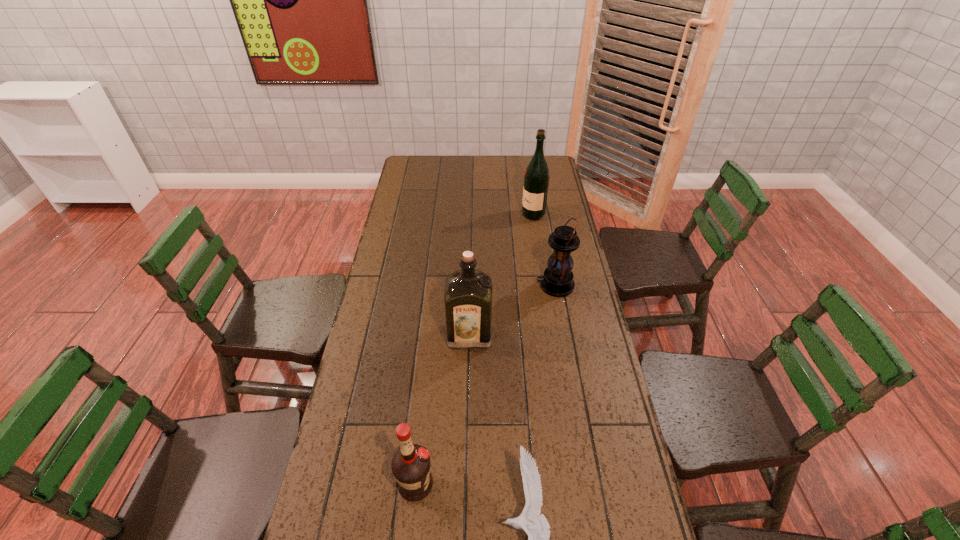
At what (x,y) coordinates should I click in order to perform the action: click on the farthest object. Please return your answer as a coordinate pair (x, y). Looking at the image, I should click on (536, 178).

Find the location of a particular element. This screenshot has height=540, width=960. the rightmost liquor is located at coordinates (536, 178).

The height and width of the screenshot is (540, 960). I want to click on the third nearest object, so click(468, 292).

Identify the location of the second nearest liquor. (468, 292).

Locate an element on the screen. the fourth nearest object is located at coordinates (557, 280).

Locate an element on the screen. the leftmost object is located at coordinates (410, 465).

The width and height of the screenshot is (960, 540). Identify the location of the shortest liquor. (410, 465).

Find the location of a particular element. The height and width of the screenshot is (540, 960). free space located 0.310m on the front-facing side of the farthest object is located at coordinates (451, 214).

The height and width of the screenshot is (540, 960). Identify the location of vacant area situated on the front-facing side of the farthest object. (501, 214).

At what (x,y) coordinates should I click in order to perform the action: click on blank space located on the front-facing side of the farthest object. Please return your answer as a coordinate pair (x, y). Looking at the image, I should click on click(x=443, y=214).